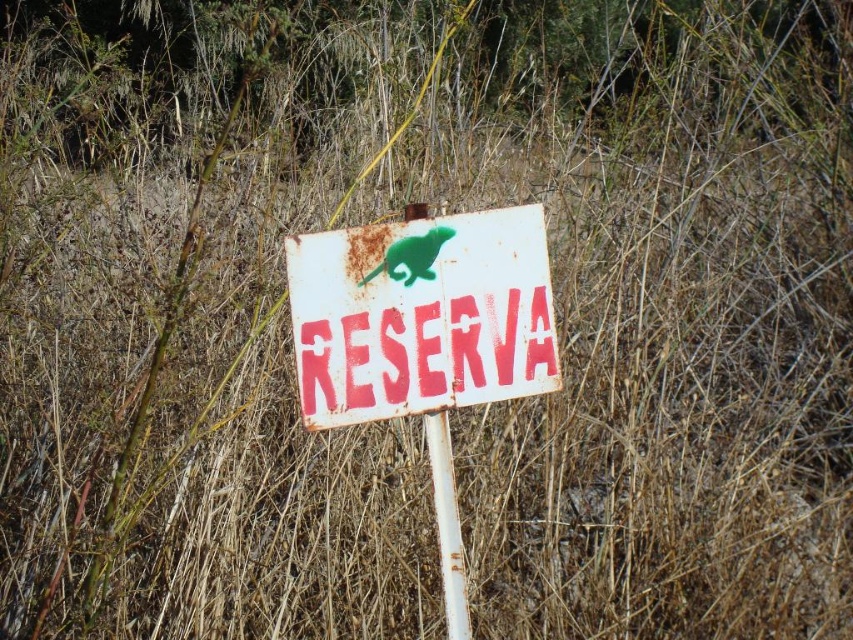
Does rusty metal sign at center have a smaller size compared to rusty metal pole at center?

No.

Does rusty metal sign at center appear under rusty metal pole at center?

No, rusty metal sign at center is not below rusty metal pole at center.

Which is in front, point (508, 273) or point (451, 552)?

Positioned in front is point (508, 273).

In order to click on rusty metal sign at center in this screenshot , I will do `click(421, 316)`.